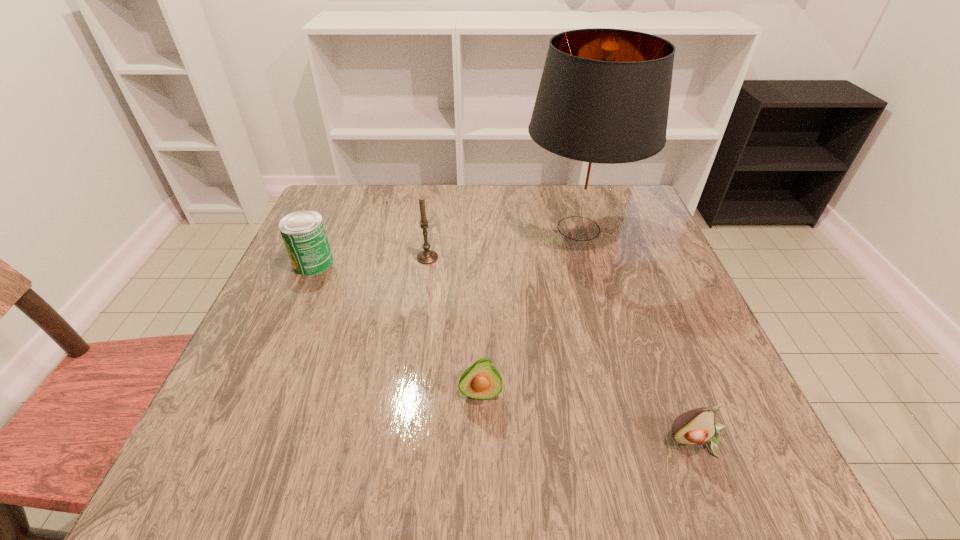
You are a GUI agent. You are given a task and a screenshot of the screen. Output one action in this format:
    pyautogui.click(x=<x>, y=<y>)
    Task: Click on the free space located on the front of the leftmost object
    
    Given the screenshot: What is the action you would take?
    pyautogui.click(x=279, y=340)

In order to click on object at the far edge in this screenshot , I will do `click(602, 105)`.

Locate an element on the screen. The width and height of the screenshot is (960, 540). object that is at the near edge is located at coordinates (697, 426).

Find the location of a particular element. This screenshot has width=960, height=540. object that is at the left edge is located at coordinates [x=303, y=232].

Find the location of a particular element. The height and width of the screenshot is (540, 960). lampshade at the right edge is located at coordinates (602, 105).

Identify the location of avocado that is positioned at the right edge. This screenshot has height=540, width=960. (697, 426).

Locate an element on the screen. object that is at the far right corner is located at coordinates tap(602, 105).

Where is `object located in the near right corner section of the desktop`? This screenshot has height=540, width=960. object located in the near right corner section of the desktop is located at coordinates (697, 426).

Locate an element on the screen. The height and width of the screenshot is (540, 960). free space at the far edge of the desktop is located at coordinates (428, 215).

This screenshot has height=540, width=960. I want to click on vacant point at the near edge, so click(462, 463).